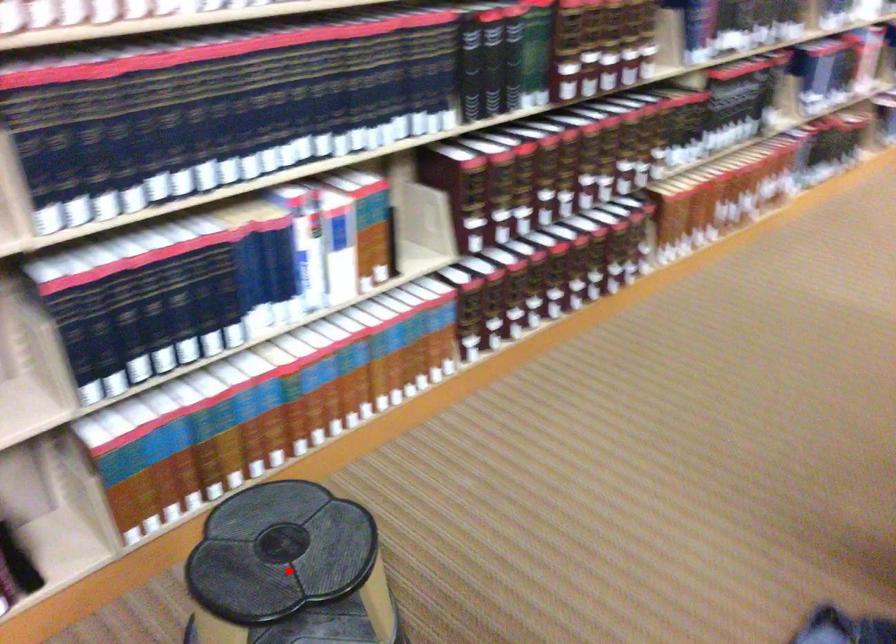
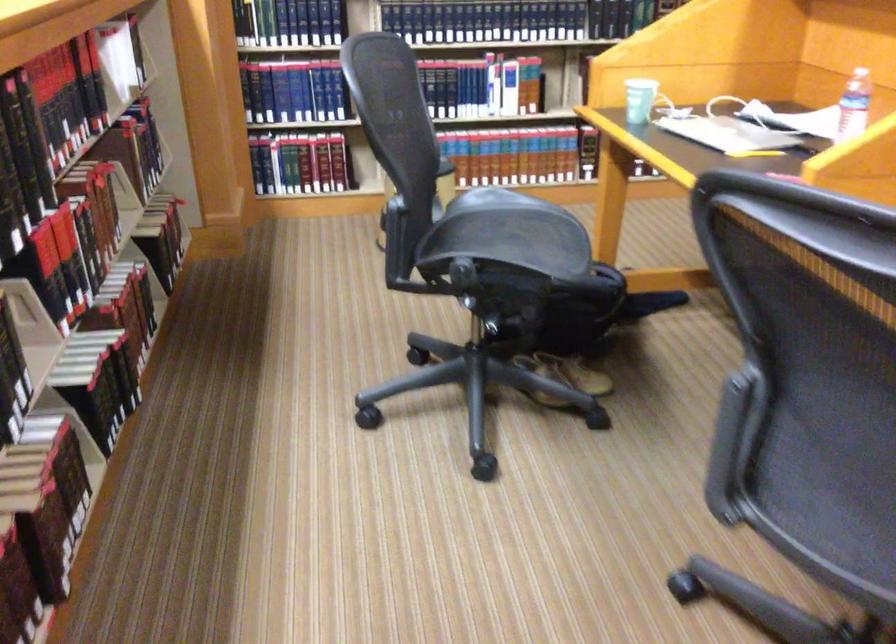
Question: I am providing you with two images of the same scene from different viewpoints. A red point is marked on the first image. Is the red point's position out of view in image 2?

Choices:
 (A) Yes
 (B) No

Answer: (A)